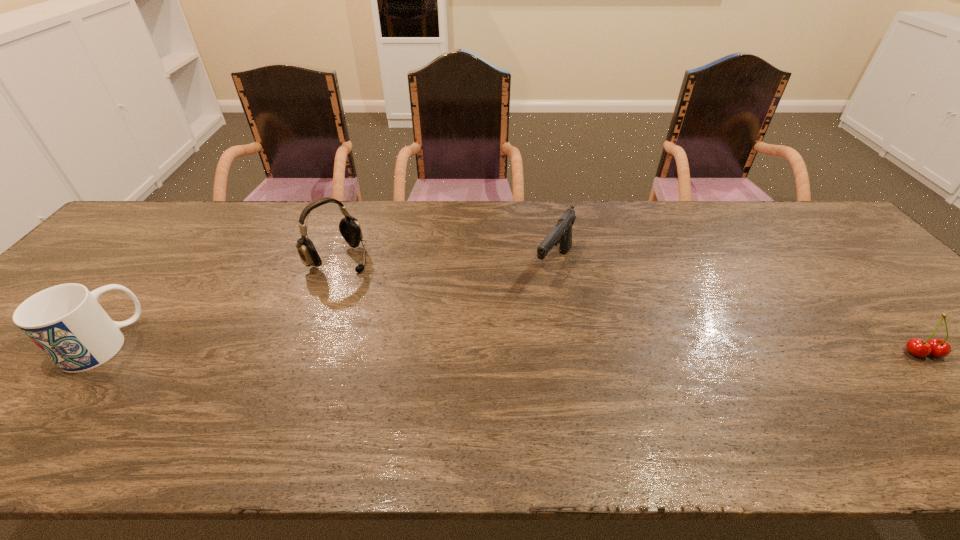
In the image, there is a desktop. At what (x,y) coordinates should I click in order to perform the action: click on vacant area at the far left corner. Please return your answer as a coordinate pair (x, y). This screenshot has width=960, height=540. Looking at the image, I should click on point(149,212).

Identify the location of vacant space at the far right corner of the desktop. Image resolution: width=960 pixels, height=540 pixels. (786, 231).

Locate an element on the screen. empty space that is in between the gun and the tallest object is located at coordinates (445, 262).

This screenshot has width=960, height=540. What are the coordinates of `free space between the mug and the cherry` in the screenshot? It's located at (513, 348).

Locate an element on the screen. The height and width of the screenshot is (540, 960). free spot between the tallest object and the shortest object is located at coordinates (630, 306).

In order to click on unoccupied area between the leftmost object and the rightmost object in this screenshot , I will do `click(513, 348)`.

I want to click on vacant space in between the leftmost object and the tallest object, so click(x=220, y=301).

Locate an element on the screen. This screenshot has width=960, height=540. blank region between the cherry and the gun is located at coordinates (738, 309).

Find the location of a particular element. The image size is (960, 540). free point between the gun and the mug is located at coordinates (328, 305).

Where is `vacant area between the cherry and the tallest object`? The image size is (960, 540). vacant area between the cherry and the tallest object is located at coordinates (630, 306).